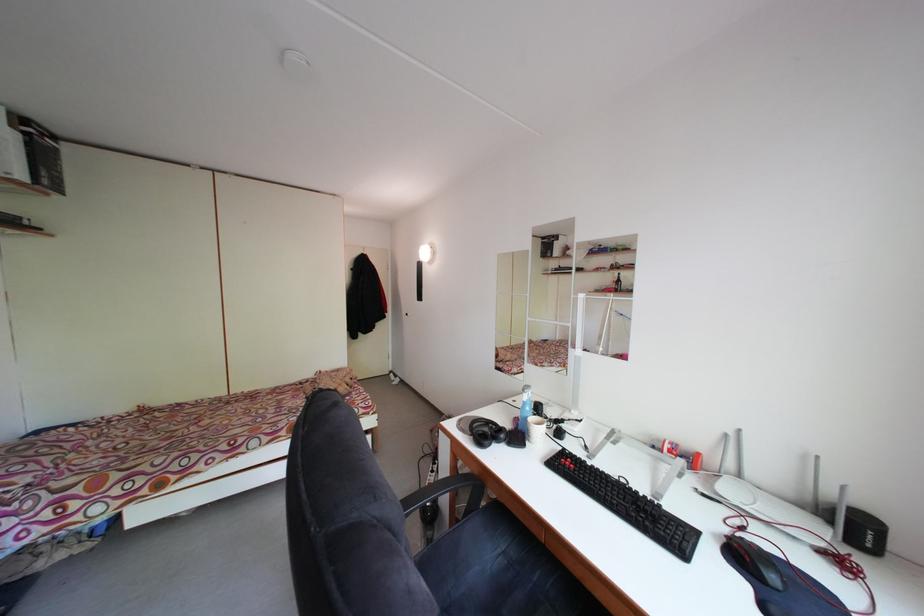
Where would you rotat the white router antenna? Please return your answer as a coordinate pair (x, y).

(738, 453)